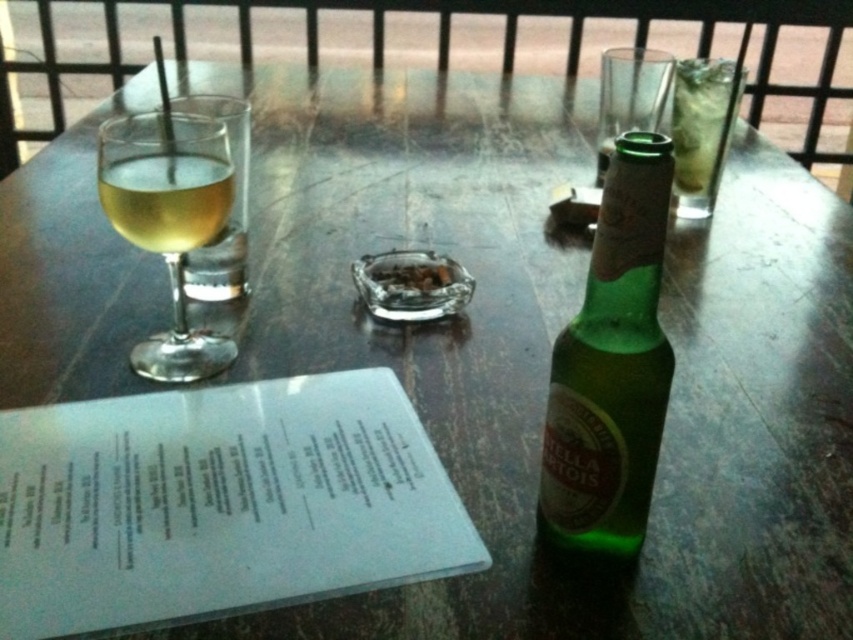
Question: Which of the following is the farthest from the observer?

Choices:
 (A) (184, 317)
 (B) (619, 310)

Answer: (A)

Question: Which object appears closest to the camera in this image?

Choices:
 (A) green glass bottle at center-right
 (B) transparent glass at left
 (C) translucent glass at left

Answer: (A)

Question: Can you confirm if white paper menu at lower left is positioned to the left of transparent glass at left?

Choices:
 (A) no
 (B) yes

Answer: (A)

Question: Which point is closer to the camera?

Choices:
 (A) (189, 157)
 (B) (143, 376)
 (C) (619, 260)
 (D) (247, 422)

Answer: (C)

Question: Does white paper menu at lower left appear under transparent glass at left?

Choices:
 (A) no
 (B) yes

Answer: (B)

Question: Is green glass bottle at center-right thinner than translucent glass at left?

Choices:
 (A) yes
 (B) no

Answer: (A)